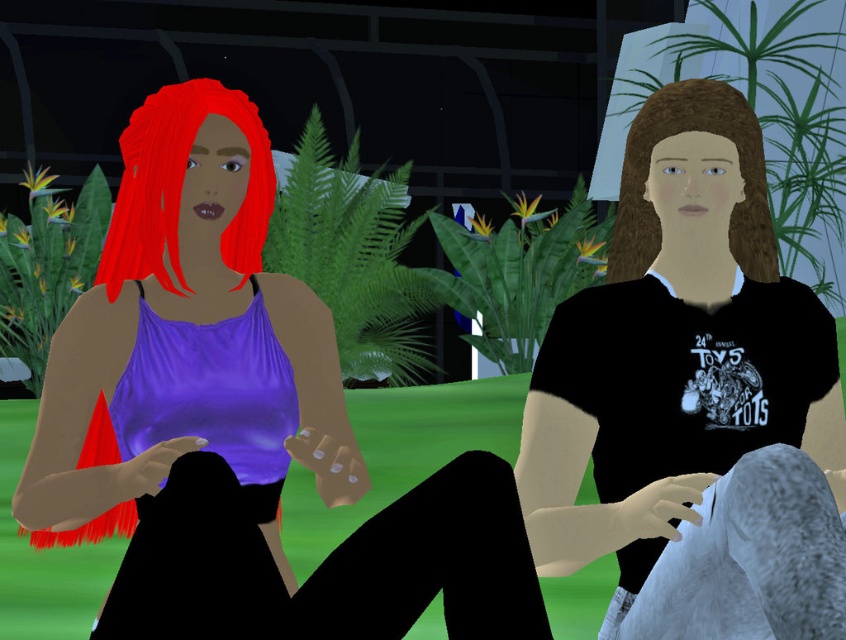
Is satin purple tank top at left to the right of matte black t-shirt at right from the viewer's perspective?

Incorrect, satin purple tank top at left is not on the right side of matte black t-shirt at right.

Where is `satin purple tank top at left`? satin purple tank top at left is located at coordinates (239, 422).

Between point (102, 296) and point (606, 417), which one is positioned behind?

Point (102, 296)

At what (x,y) coordinates should I click in order to perform the action: click on satin purple tank top at left. Please return your answer as a coordinate pair (x, y). Looking at the image, I should click on (239, 422).

Does point (625, 456) come behind point (128, 234)?

No, it is in front of (128, 234).

Does matte black t-shirt at right appear over shiny red hair at left?

Actually, matte black t-shirt at right is below shiny red hair at left.

The width and height of the screenshot is (846, 640). What do you see at coordinates (691, 401) in the screenshot?
I see `matte black t-shirt at right` at bounding box center [691, 401].

You are a GUI agent. You are given a task and a screenshot of the screen. Output one action in this format:
    pyautogui.click(x=<x>, y=<y>)
    Task: Click on the matte black t-shirt at right
    Image resolution: width=846 pixels, height=640 pixels.
    Given the screenshot: What is the action you would take?
    (x=691, y=401)

Does satin purple tank top at left come behind brown matte hair at center?

No, satin purple tank top at left is closer to the viewer.

Does satin purple tank top at left appear on the left side of brown matte hair at center?

Indeed, satin purple tank top at left is positioned on the left side of brown matte hair at center.

Which is in front, point (268, 314) or point (762, 236)?

Positioned in front is point (268, 314).

The image size is (846, 640). What are the coordinates of `satin purple tank top at left` in the screenshot? It's located at (239, 422).